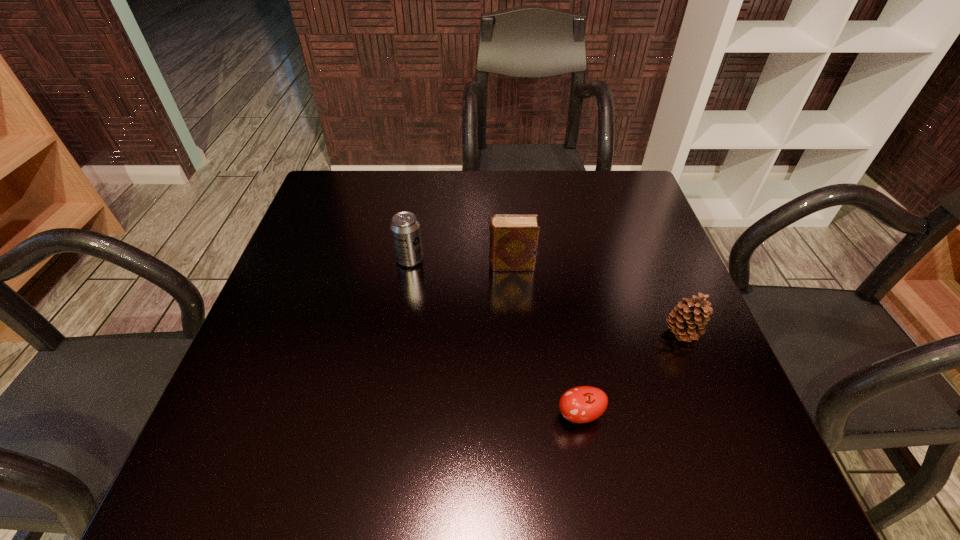
Where is `vacant region located 0.160m on the left of the pinecone`? The width and height of the screenshot is (960, 540). vacant region located 0.160m on the left of the pinecone is located at coordinates (583, 333).

This screenshot has width=960, height=540. Find the location of `vacant space located 0.150m on the back of the shortest object`. vacant space located 0.150m on the back of the shortest object is located at coordinates (565, 332).

Locate an element on the screen. object that is positioned at the right edge is located at coordinates (688, 318).

Find the location of a particular element. The height and width of the screenshot is (540, 960). vacant space at the far edge of the desktop is located at coordinates (580, 211).

Find the location of a particular element. This screenshot has width=960, height=540. free location at the near edge of the desktop is located at coordinates (380, 480).

Find the location of a particular element. free space at the left edge is located at coordinates (331, 279).

The width and height of the screenshot is (960, 540). In the image, there is a desktop. Identify the location of vacant region at the right edge. (597, 222).

Find the location of `vacant space at the far left corner of the desktop`. vacant space at the far left corner of the desktop is located at coordinates (369, 207).

This screenshot has height=540, width=960. Find the location of `free location at the far right corner of the desktop`. free location at the far right corner of the desktop is located at coordinates (623, 187).

At what (x,y) coordinates should I click in order to perform the action: click on vacant area at the near right corner. Please return your answer as a coordinate pair (x, y). This screenshot has width=960, height=540. Looking at the image, I should click on (705, 468).